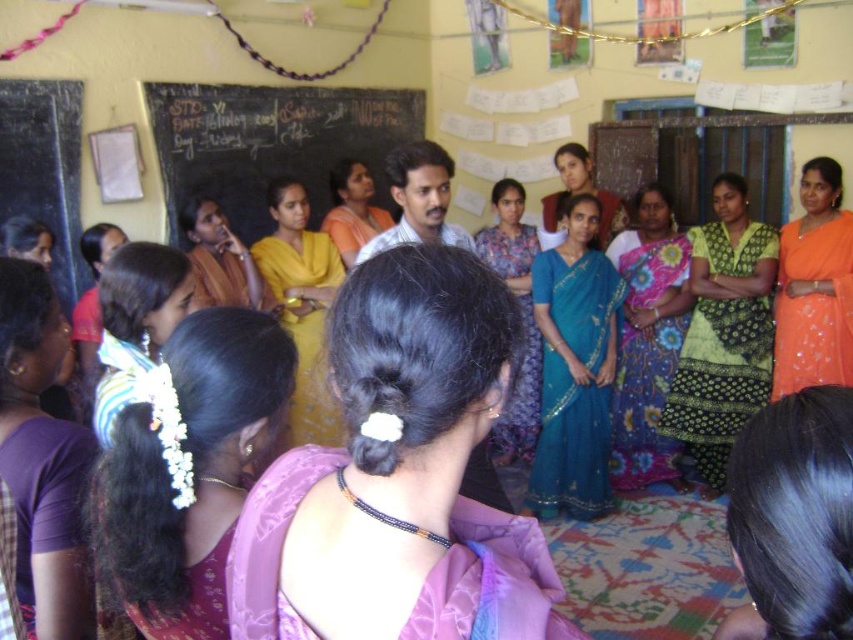
You are a photographer standing in front of the group. You need to capture a photo where both the floral silk saree at center and the matte white shirt at center are visible. Based on their positions, which one should you focus on first to ensure both are in the frame?

The floral silk saree at center is below the matte white shirt at center, so you should focus on the matte white shirt at center first to ensure both are in the frame.

You are a photographer positioned at the front of the classroom. You need to capture a photo that includes both the floral silk saree at center and the matte white shirt at center. However, your camera has a limited focus range. Which object should you focus on to ensure it appears clearer in the photo?

The floral silk saree at center is much taller than the matte white shirt at center. Since it is taller, it would be farther away from the camera, so focusing on the matte white shirt at center would ensure it is in focus while the saree might be slightly out of focus. Alternatively, focusing on the saree would make it clearer if it is the primary subject.